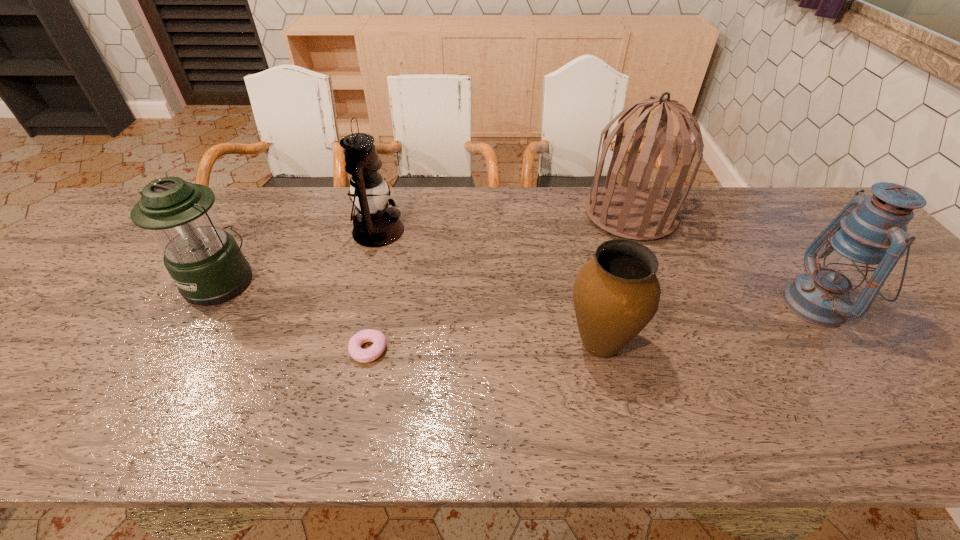
In order to click on free space located 0.370m on the front-facing side of the rightmost object in this screenshot , I will do coord(635,305).

Locate an element on the screen. vacant space located 0.170m on the back of the leftmost object is located at coordinates (257, 219).

This screenshot has height=540, width=960. In order to click on free space located 0.150m on the right of the urn in this screenshot , I will do `click(703, 345)`.

I want to click on vacant space situated on the right of the doughnut, so click(539, 349).

Identify the location of birdcage present at the far edge. (628, 211).

Find the location of `lantern that is at the far edge`. lantern that is at the far edge is located at coordinates (375, 225).

The image size is (960, 540). In the image, there is a desktop. Identify the location of free space at the far edge. (520, 205).

Where is `free space at the near edge`? Image resolution: width=960 pixels, height=540 pixels. free space at the near edge is located at coordinates (522, 414).

I want to click on vacant space at the right edge of the desktop, so click(x=896, y=350).

Image resolution: width=960 pixels, height=540 pixels. In order to click on vacant point located between the second lantern from left to right and the urn in this screenshot , I will do `click(490, 288)`.